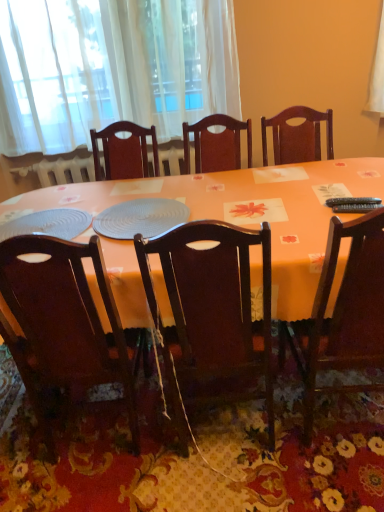
Question: In terms of width, does black plastic remote control at right, the 2th remote control ordered from the bottom, look wider or thinner when compared to dark wood chair at center, marked as the 2th chair in a right-to-left arrangement?

Choices:
 (A) wide
 (B) thin

Answer: (B)

Question: Considering the positions of black plastic remote control at right, arranged as the first remote control when viewed from the top, and dark wood chair at center, which is the second chair in left-to-right order, in the image, is black plastic remote control at right, arranged as the first remote control when viewed from the top, taller or shorter than dark wood chair at center, which is the second chair in left-to-right order,?

Choices:
 (A) tall
 (B) short

Answer: (B)

Question: Which object is the farthest from the matte blue placemat at center?

Choices:
 (A) wooden chair at right, the 3th chair in the left-to-right sequence
 (B) dark wood chair at center, which is the second chair in left-to-right order
 (C) white sheer curtain at upper left
 (D) black plastic remote control at right, which is counted as the 2th remote control, starting from the top
 (E) black plastic remote control at right, the 2th remote control ordered from the bottom

Answer: (C)

Question: Which object is the farthest from the dark wood chair at center, marked as the 2th chair in a right-to-left arrangement?

Choices:
 (A) wooden chair at right, which is the first chair in right-to-left order
 (B) white sheer curtain at upper left
 (C) orange fabric table at center
 (D) black plastic remote control at right, which is counted as the 2th remote control, starting from the top
 (E) dark wood chair at lower left, arranged as the 1th chair when viewed from the left

Answer: (B)